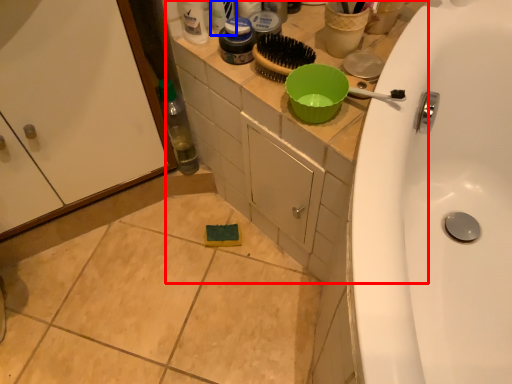
Question: Which object appears closest to the camera in this image, counter top (highlighted by a red box) or toiletry (highlighted by a blue box)?

Choices:
 (A) counter top
 (B) toiletry

Answer: (A)